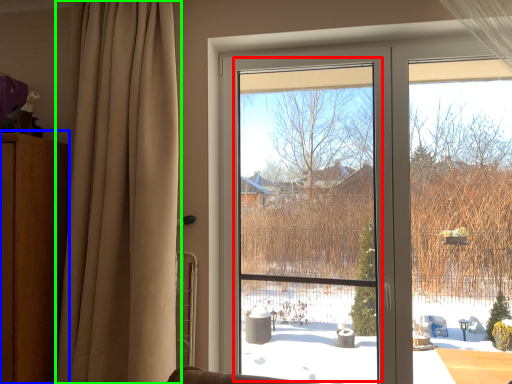
Question: Estimate the real-world distances between objects in this image. Which object is closer to window screen (highlighted by a red box), dresser (highlighted by a blue box) or curtain (highlighted by a green box)?

Choices:
 (A) dresser
 (B) curtain

Answer: (B)